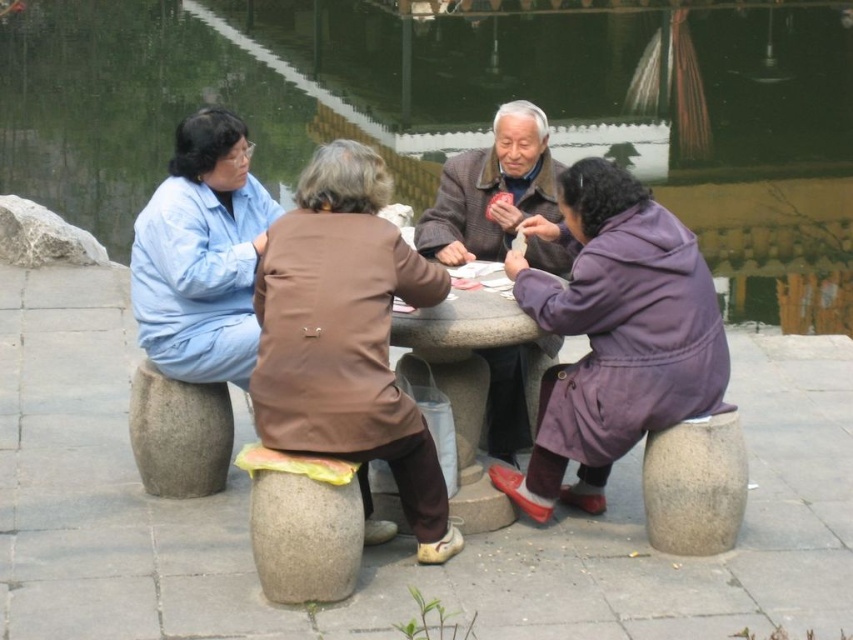
Question: Can you confirm if brown leather jacket at center is wider than purple woolen coat at lower right?

Choices:
 (A) no
 (B) yes

Answer: (A)

Question: Can you confirm if brown leather jacket at center is thinner than brown woolen coat at center?

Choices:
 (A) yes
 (B) no

Answer: (B)

Question: Which object is closer to the camera taking this photo?

Choices:
 (A) brown leather jacket at center
 (B) light blue fabric at left

Answer: (A)

Question: Which point appears farthest from the camera in this image?

Choices:
 (A) (627, 422)
 (B) (454, 545)
 (C) (540, 164)

Answer: (C)

Question: Does purple woolen coat at lower right come behind brown woolen coat at center?

Choices:
 (A) yes
 (B) no

Answer: (B)

Question: Which point is farther from the camera taking this photo?

Choices:
 (A) (527, 282)
 (B) (281, 412)

Answer: (A)